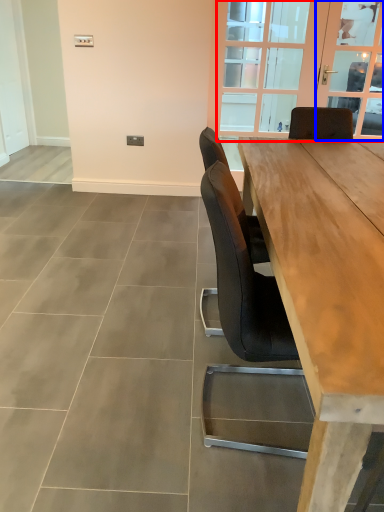
Question: Which of the following is the closest to the observer, window (highlighted by a red box) or window screen (highlighted by a blue box)?

Choices:
 (A) window
 (B) window screen

Answer: (A)